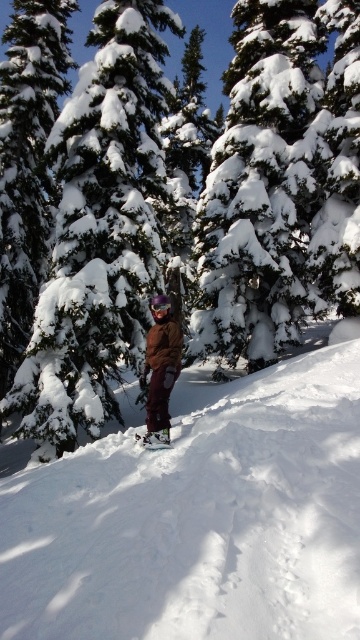
Is matte brown jacket at center in front of black matte snowboard at center?

That is True.

Does point (167, 422) come farther from viewer compared to point (168, 440)?

Yes, point (167, 422) is farther from viewer.

Image resolution: width=360 pixels, height=640 pixels. What are the coordinates of `matte brown jacket at center` in the screenshot? It's located at (160, 369).

Who is more forward, (23, 317) or (146, 440)?

Point (146, 440)

Is snow-covered evergreen tree at left wider than black matte snowboard at center?

Yes, snow-covered evergreen tree at left is wider than black matte snowboard at center.

Where is `snow-covered evergreen tree at left`? The image size is (360, 640). snow-covered evergreen tree at left is located at coordinates (28, 161).

Who is more forward, (267,212) or (150,435)?

Positioned in front is point (150,435).

Between point (315, 122) and point (159, 433), which one is positioned behind?

Positioned behind is point (315, 122).

Identify the location of snow-covered evergreen tree at upper center. (281, 182).